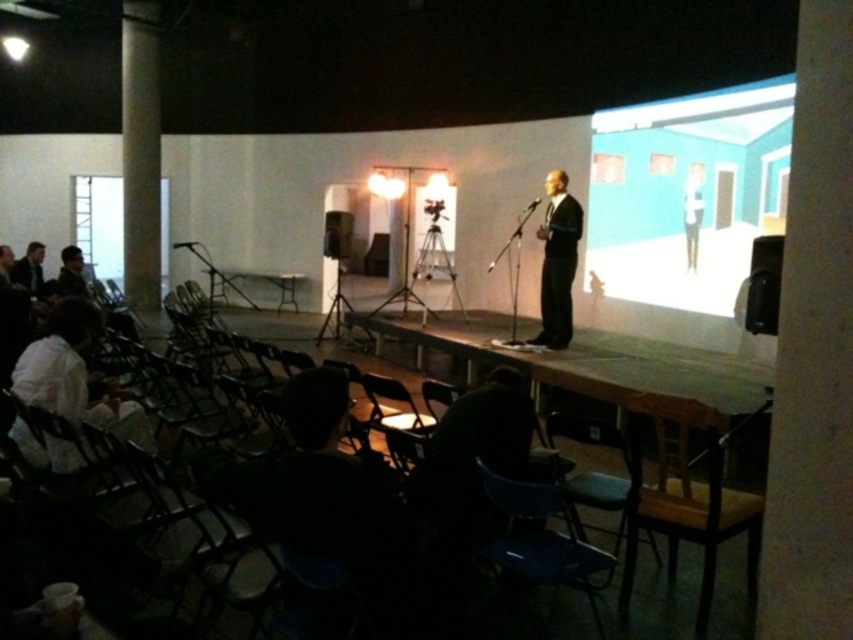
Question: Which point is closer to the camera?

Choices:
 (A) [x=625, y=220]
 (B) [x=583, y=502]
 (C) [x=44, y=246]
 (D) [x=340, y=212]

Answer: (B)

Question: From the image, what is the correct spatial relationship of green plastic chair at lower center in relation to matte black suit at center?

Choices:
 (A) left
 (B) right

Answer: (A)

Question: Does teal matte painting at upper right come behind matte black suit at center?

Choices:
 (A) yes
 (B) no

Answer: (B)

Question: Does teal matte painting at upper right appear under green plastic chair at lower center?

Choices:
 (A) yes
 (B) no

Answer: (B)

Question: Which of the following is the farthest from the observer?

Choices:
 (A) (26, 285)
 (B) (695, 237)
 (C) (544, 257)

Answer: (A)

Question: Which point is farther to the camera?

Choices:
 (A) matte black suit at center
 (B) matte black suit at left

Answer: (B)